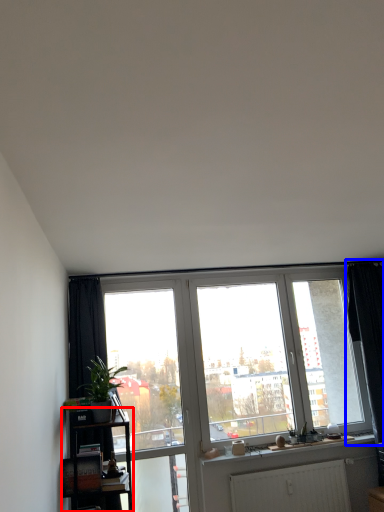
Question: Among these objects, which one is farthest to the camera, shelf (highlighted by a red box) or curtain (highlighted by a blue box)?

Choices:
 (A) shelf
 (B) curtain

Answer: (B)